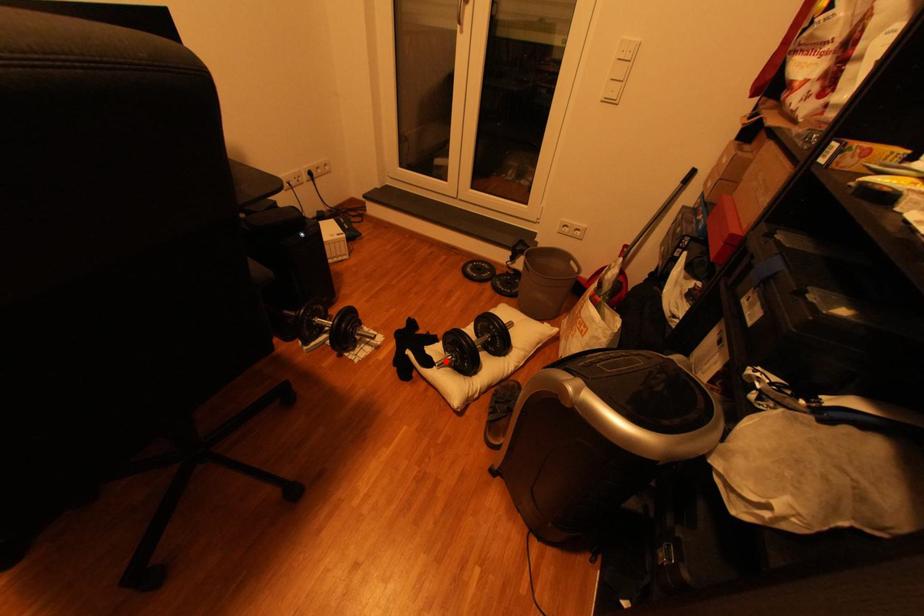
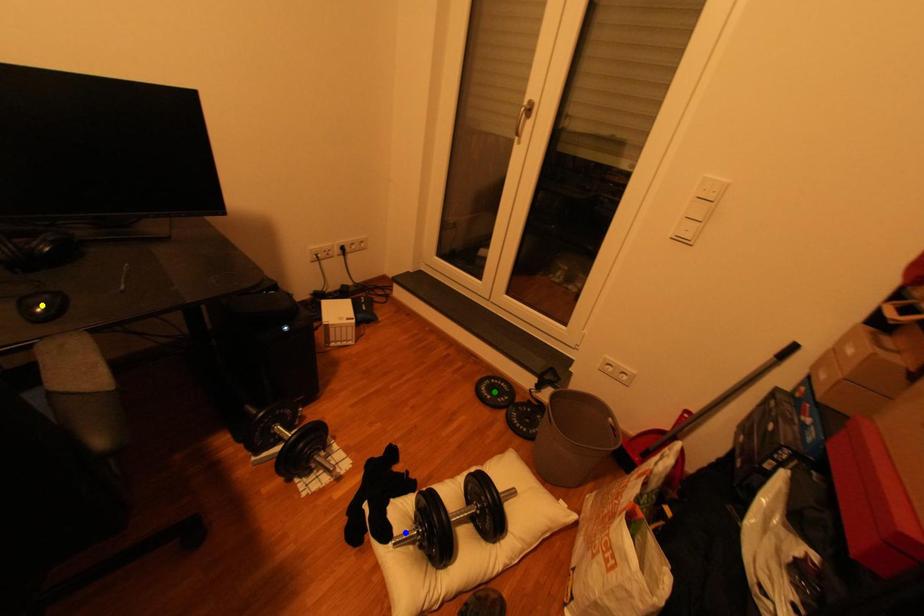
Question: I am providing you with two images of the same scene from different viewpoints. A red point is marked on the first image. You are given multiple points on the second image. Can you choose the point in image 2 that corresponds to the point in image 1?

Choices:
 (A) blue point
 (B) yellow point
 (C) green point

Answer: (A)